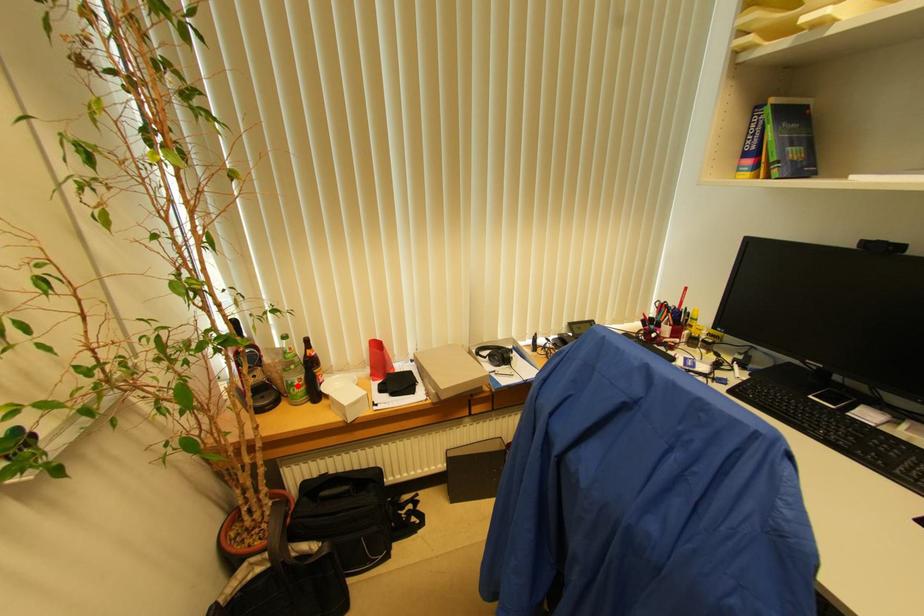
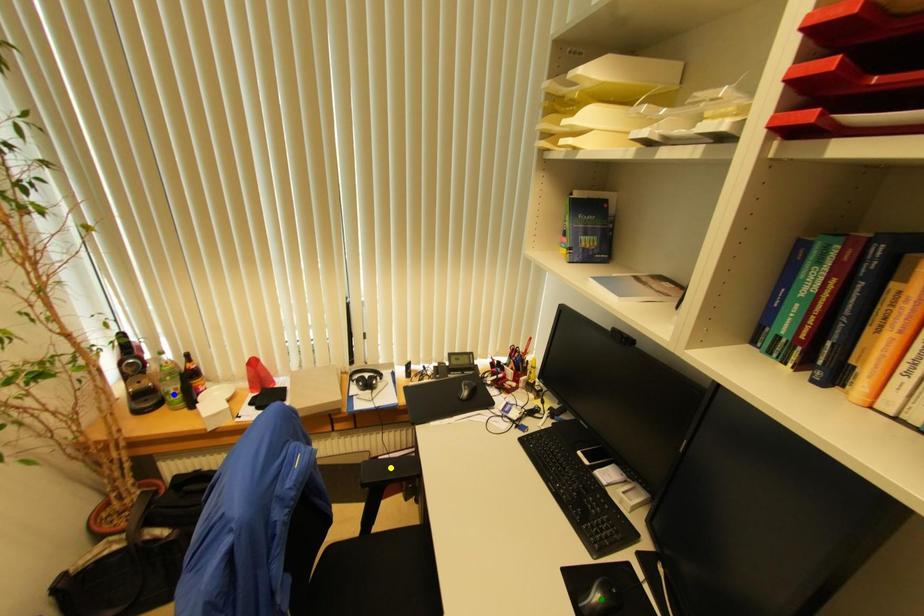
Question: I am providing you with two images of the same scene from different viewpoints. A red point is marked on the first image. You are given multiple points on the second image. Which point in image 2 is actually the same real-world point as the red point in image 1?

Choices:
 (A) blue point
 (B) yellow point
 (C) green point

Answer: (A)